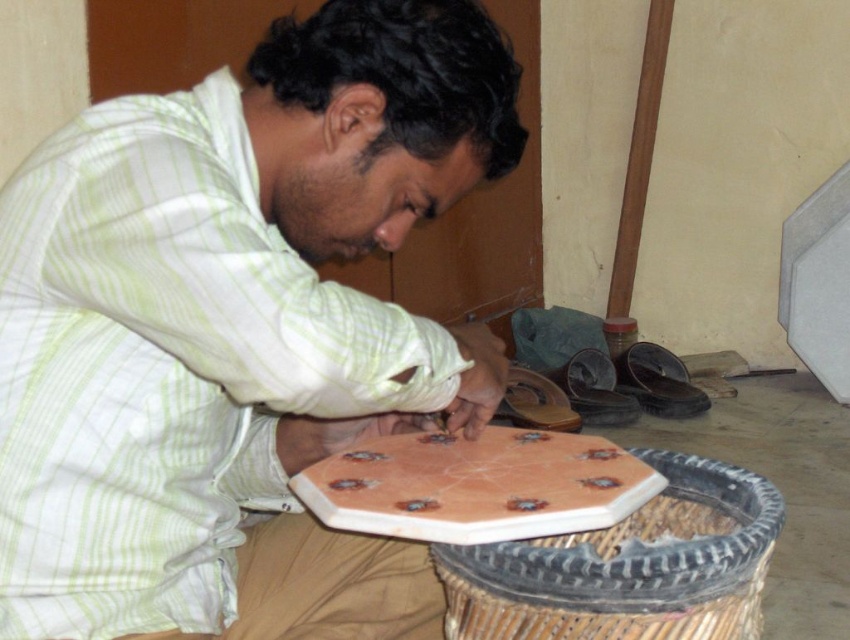
Is point (649, 348) less distant than point (561, 384)?

No, (649, 348) is behind (561, 384).

Does black rubber shoe at lower center have a greater width compared to black leather shoe at lower right?

Yes, black rubber shoe at lower center is wider than black leather shoe at lower right.

Between point (676, 412) and point (609, 426), which one is positioned behind?

Positioned behind is point (676, 412).

At what (x,y) coordinates should I click in order to perform the action: click on black rubber shoe at lower center. Please return your answer as a coordinate pair (x, y). The width and height of the screenshot is (850, 640). Looking at the image, I should click on (658, 381).

Can you confirm if white striped shirt at center is positioned below pink glossy board game at center?

Actually, white striped shirt at center is above pink glossy board game at center.

Between white striped shirt at center and pink glossy board game at center, which one appears on the right side from the viewer's perspective?

pink glossy board game at center

Image resolution: width=850 pixels, height=640 pixels. What are the coordinates of `white striped shirt at center` in the screenshot? It's located at (236, 330).

The width and height of the screenshot is (850, 640). What do you see at coordinates (236, 330) in the screenshot? I see `white striped shirt at center` at bounding box center [236, 330].

Between white striped shirt at center and black leather shoe at lower right, which one appears on the right side from the viewer's perspective?

black leather shoe at lower right

Describe the element at coordinates (236, 330) in the screenshot. I see `white striped shirt at center` at that location.

At what (x,y) coordinates should I click in order to perform the action: click on white striped shirt at center. Please return your answer as a coordinate pair (x, y). Looking at the image, I should click on 236,330.